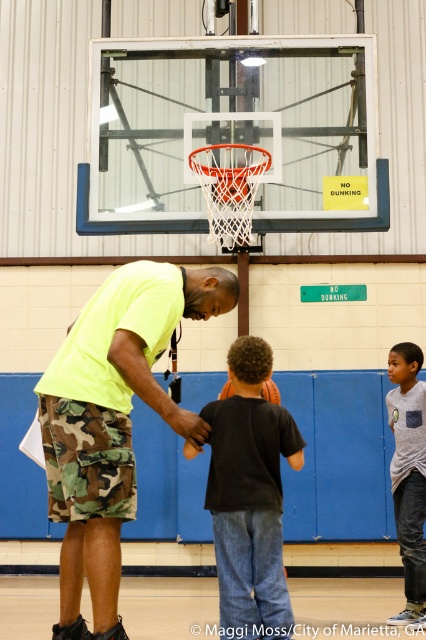
Does neon yellow shirt at center appear over black cotton shirt at center?

Yes.

Does point (201, 269) lie in front of point (276, 492)?

Yes, it is.

Identify the location of neon yellow shirt at center. (112, 420).

Which of these two, black cotton shirt at center or gray cotton shirt at right, stands taller?

Standing taller between the two is gray cotton shirt at right.

Consider the image. Is black cotton shirt at center above gray cotton shirt at right?

Yes, black cotton shirt at center is above gray cotton shirt at right.

Does point (259, 406) lie in front of point (412, 397)?

That is True.

Where is `black cotton shirt at center`? The width and height of the screenshot is (426, 640). black cotton shirt at center is located at coordinates (250, 497).

Is black cotton shirt at center to the left of rubber basketball at center from the viewer's perspective?

Correct, you'll find black cotton shirt at center to the left of rubber basketball at center.

Between black cotton shirt at center and rubber basketball at center, which one is positioned higher?

rubber basketball at center

Is point (282, 420) behind point (273, 385)?

No, (282, 420) is in front of (273, 385).

Where is `black cotton shirt at center`? The image size is (426, 640). black cotton shirt at center is located at coordinates (250, 497).